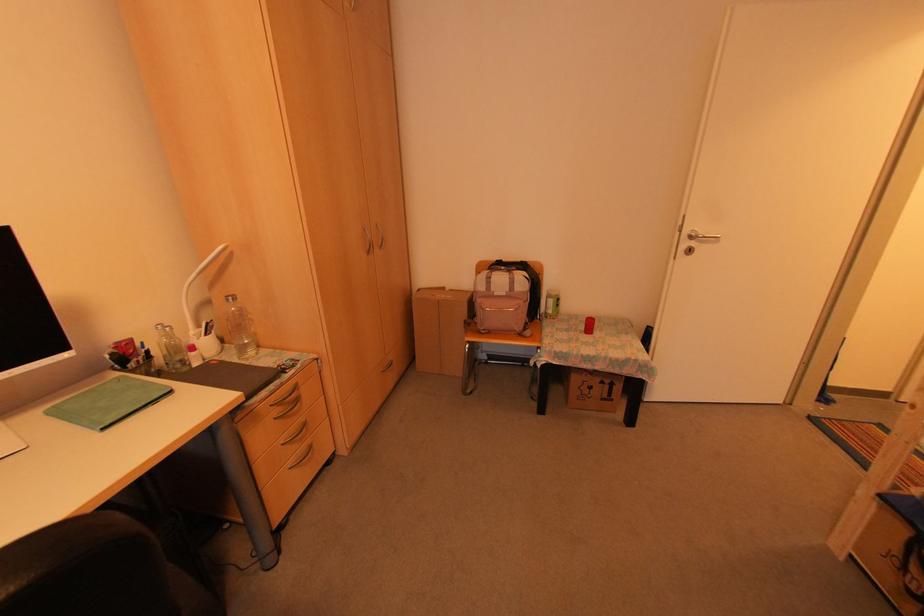
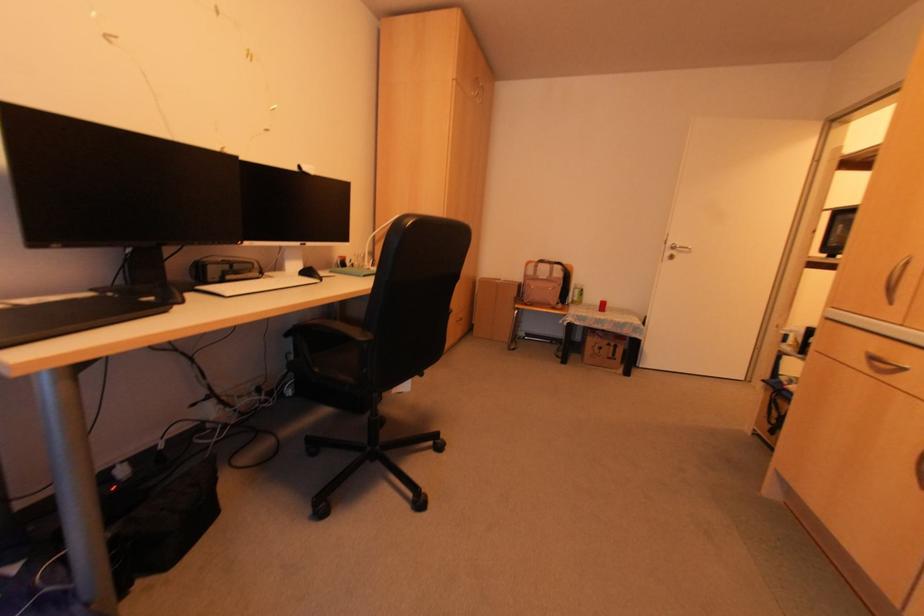
Question: The images are taken continuously from a first-person perspective. In which direction are you moving?

Choices:
 (A) Left
 (B) Right
 (C) Forward
 (D) Backward

Answer: (D)